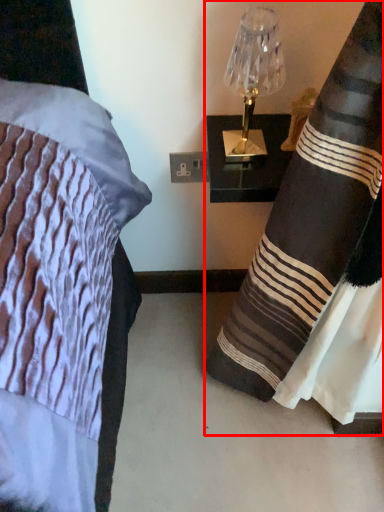
Question: Where is curtain (annotated by the red box) located in relation to lamp in the image?

Choices:
 (A) left
 (B) right

Answer: (B)